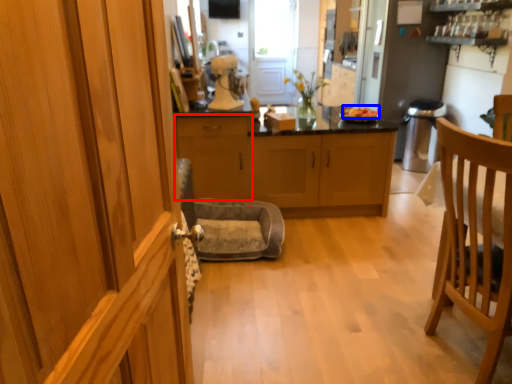
Question: Which point is further to the camera, cabinetry (highlighted by a red box) or food (highlighted by a blue box)?

Choices:
 (A) cabinetry
 (B) food

Answer: (B)